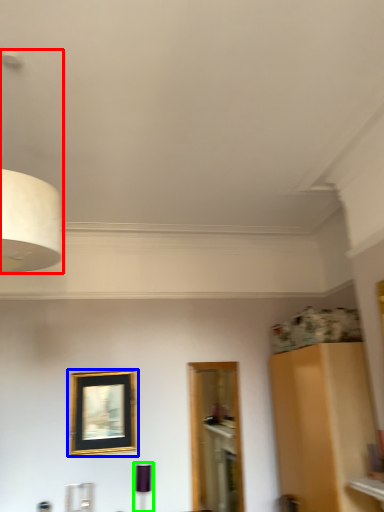
Question: Which object is positioned farthest from lamp (highlighted by a red box)? Select from picture frame (highlighted by a blue box) and lamp (highlighted by a green box).

Choices:
 (A) picture frame
 (B) lamp

Answer: (B)